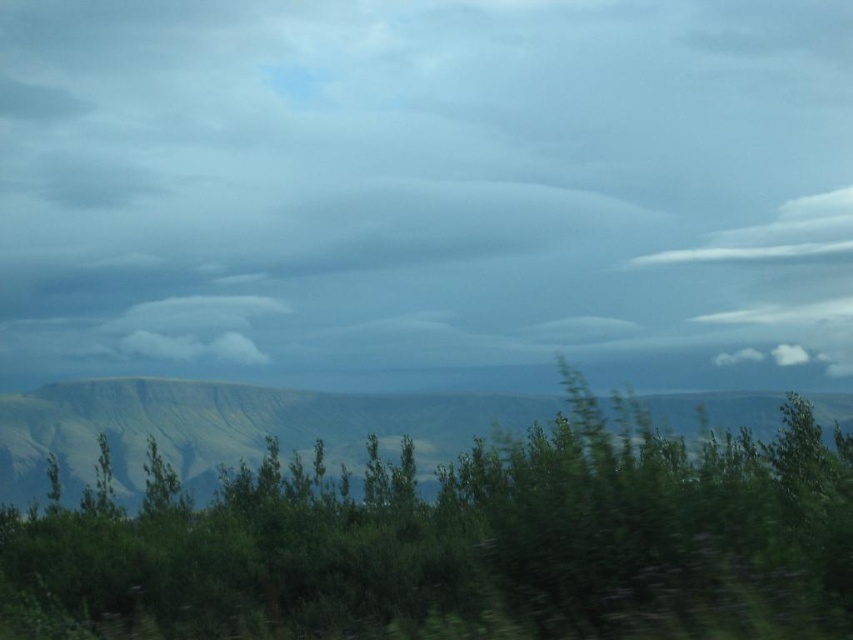
Between gray/cloudy sky at center and green leafy shrub at center, which one is positioned higher?

Positioned higher is gray/cloudy sky at center.

Does gray/cloudy sky at center have a smaller size compared to green leafy shrub at center?

Yes.

Which is in front, point (822, 17) or point (668, 573)?

Point (668, 573) is in front.

You are a GUI agent. You are given a task and a screenshot of the screen. Output one action in this format:
    pyautogui.click(x=<x>, y=<y>)
    Task: Click on the gray/cloudy sky at center
    The height and width of the screenshot is (640, 853).
    Given the screenshot: What is the action you would take?
    pyautogui.click(x=426, y=189)